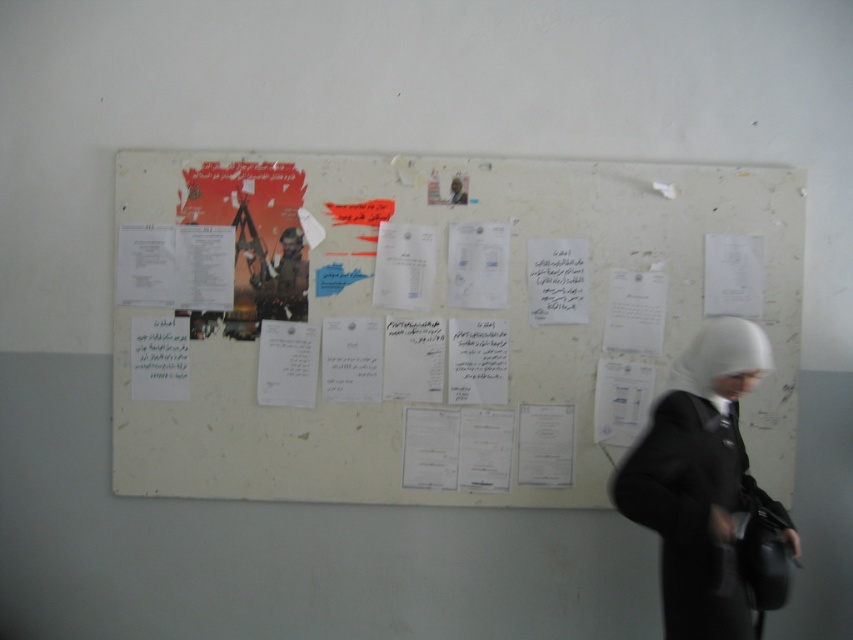
You are designing a layout for a bulletin board and have two items to place on it. You have a white matte hijab at center and a camouflage fabric soldier at center. Which item takes up more horizontal space on the board?

The white matte hijab at center takes up more horizontal space than the camouflage fabric soldier at center because its width is larger.

You are a delivery person who needs to hang a new notice on the bulletin board. You see the white matte hijab at center and the camouflage fabric soldier at center. Which object should you place your notice to the left of to ensure it is positioned correctly?

You should place your notice to the left of the camouflage fabric soldier at center because the white matte hijab at center is already positioned to the right of it.